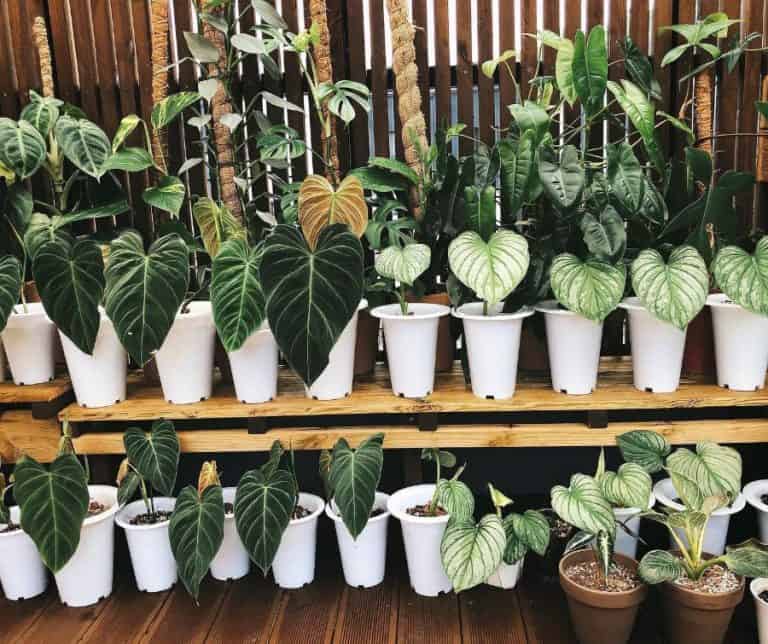
This screenshot has width=768, height=644. I want to click on pot, so click(25, 339).